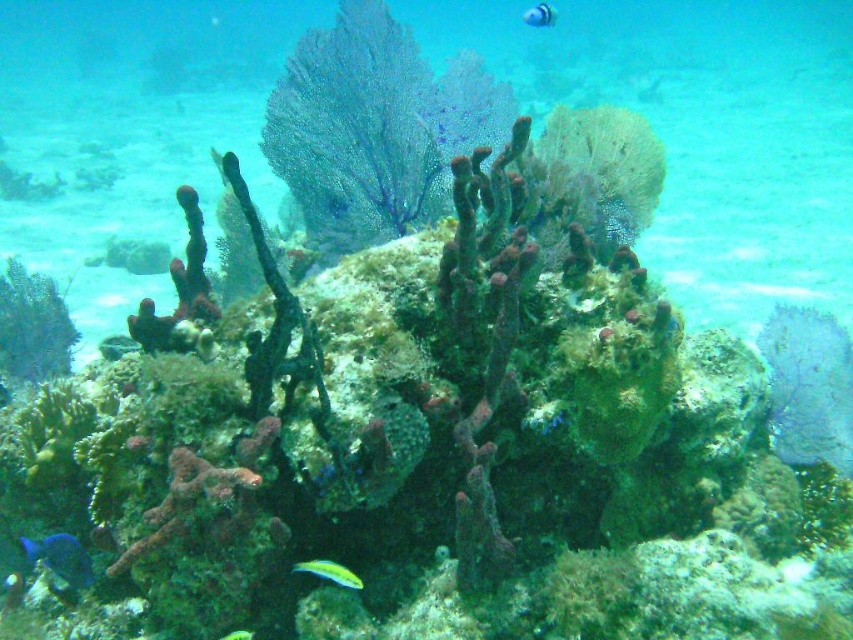
You are a marine biologist observing this underwater scene. You notice the translucent purple coral at upper left and the shiny blue fish at lower left. From your vantage point, which object is closer to you?

The translucent purple coral at upper left is closer to you because the shiny blue fish at lower left is behind it.

You are a scuba diver observing the underwater scene. You notice the translucent purple coral at upper left and the blue glossy fish at upper center. Which object is located to the left of the other?

The translucent purple coral at upper left is positioned on the left side of the blue glossy fish at upper center.

You are a marine biologist diving in this underwater scene. You need to take a close look at the translucent purple coral at upper left. If your diving equipment allows you to move up to 3 meters, can you reach it?

The translucent purple coral at upper left and camera are 2.95 meters apart, so yes, you can reach it since the distance is within your equipment limit of 3 meters.